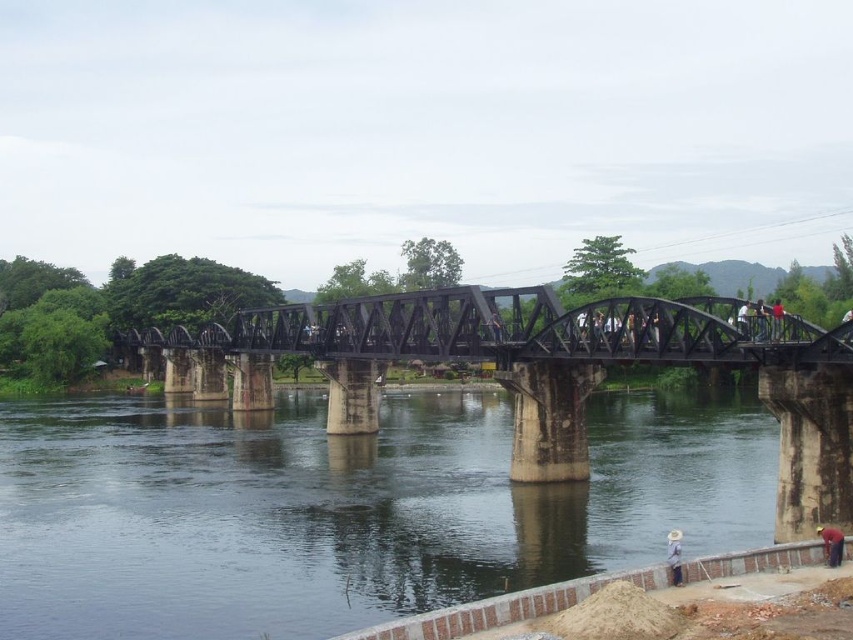
Does black metal bridge at center have a greater height compared to light blue shirt at upper right?

Correct, black metal bridge at center is much taller as light blue shirt at upper right.

Is black metal bridge at center above light blue shirt at upper right?

Incorrect, black metal bridge at center is not positioned above light blue shirt at upper right.

Where is `black metal bridge at center`? black metal bridge at center is located at coordinates (485, 353).

Does clear water at bridge lower appear on the left side of light blue shirt at upper right?

Yes, clear water at bridge lower is to the left of light blue shirt at upper right.

Between clear water at bridge lower and light blue shirt at upper right, which one has less height?

light blue shirt at upper right

Which is behind, point (73, 449) or point (738, 326)?

The point (73, 449) is more distant.

Image resolution: width=853 pixels, height=640 pixels. I want to click on clear water at bridge lower, so click(343, 509).

Who is taller, red matte shirt at lower right or light blue shirt at upper right?

light blue shirt at upper right

The width and height of the screenshot is (853, 640). Describe the element at coordinates (831, 545) in the screenshot. I see `red matte shirt at lower right` at that location.

This screenshot has width=853, height=640. What are the coordinates of `red matte shirt at lower right` in the screenshot? It's located at [831, 545].